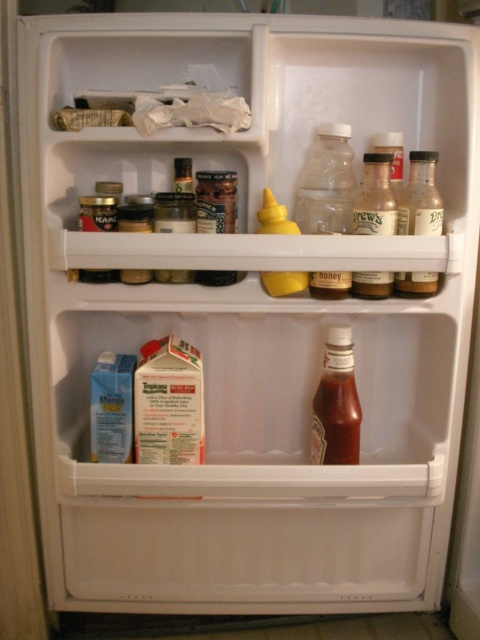
Question: Which object is closer to the camera taking this photo?

Choices:
 (A) translucent plastic bottle at center
 (B) shiny glass bottle of ketchup at center

Answer: (A)

Question: Does shiny glass bottle of ketchup at center lie behind clear glass bottle at upper right?

Choices:
 (A) no
 (B) yes

Answer: (B)

Question: Does translucent plastic bottle at center appear on the right side of clear glass bottle at upper right?

Choices:
 (A) no
 (B) yes

Answer: (A)

Question: Which object is the farthest from the shiny glass bottle of ketchup at center?

Choices:
 (A) translucent plastic bottle at center
 (B) clear glass bottle at upper right
 (C) translucent glass jar at center

Answer: (A)

Question: Which of the following is the farthest from the observer?

Choices:
 (A) (262, 200)
 (B) (334, 288)

Answer: (A)

Question: Can you confirm if clear glass bottle at upper right is thinner than translucent glass jar at center?

Choices:
 (A) no
 (B) yes

Answer: (B)